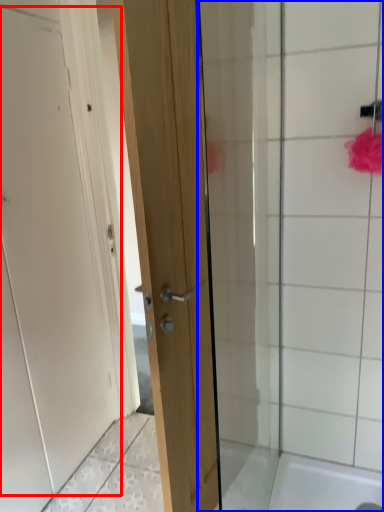
Question: Which of the following is the farthest to the observer, door (highlighted by a red box) or shower door (highlighted by a blue box)?

Choices:
 (A) door
 (B) shower door

Answer: (B)